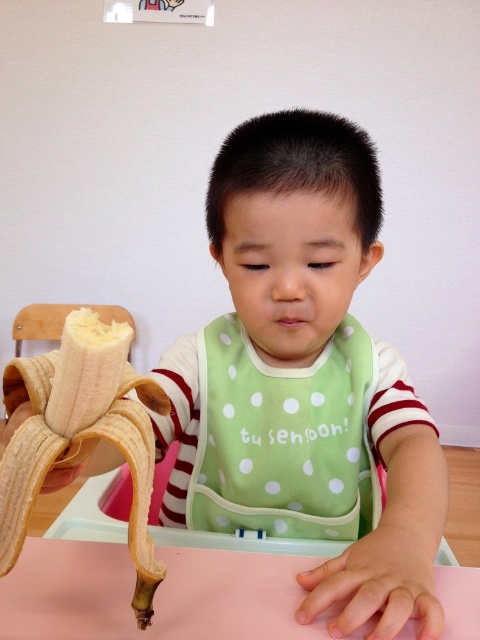
Is pink matte table at lower center smaller than yellow matte banana at lower left?

Yes, pink matte table at lower center is smaller than yellow matte banana at lower left.

Does pink matte table at lower center have a lesser width compared to yellow matte banana at lower left?

No.

Does point (126, 547) lie in front of point (24, 520)?

No, (126, 547) is further to viewer.

This screenshot has height=640, width=480. Find the location of `pink matte table at lower center`. pink matte table at lower center is located at coordinates (155, 595).